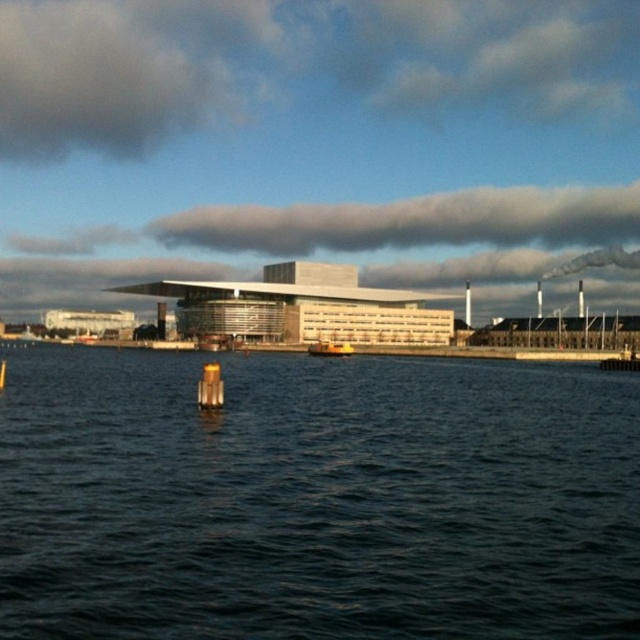
Does dark blue water at center lie behind yellow rubber boat at center?

No, it is not.

Is dark blue water at center positioned in front of yellow rubber boat at center?

That is True.

Is point (323, 602) behind point (333, 340)?

No, (323, 602) is in front of (333, 340).

Find the location of a particular element. The width and height of the screenshot is (640, 640). dark blue water at center is located at coordinates (316, 499).

Is dark blue water at center closer to the viewer compared to white fluffy cloud at upper center?

Yes, it is in front of white fluffy cloud at upper center.

Is point (556, 611) positioned in front of point (561, 202)?

Yes.

Which is behind, point (588, 538) or point (513, 205)?

The point (513, 205) is more distant.

This screenshot has width=640, height=640. Find the location of `dark blue water at center`. dark blue water at center is located at coordinates (316, 499).

Is point (384, 230) positioned after point (337, 348)?

Yes, point (384, 230) is behind point (337, 348).

Where is `white fluffy cloud at upper center`? white fluffy cloud at upper center is located at coordinates (413, 221).